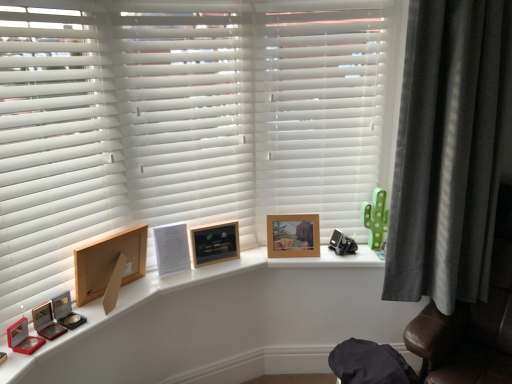
The image size is (512, 384). What are the coordinates of `vacant space to the right of wooden photo frame at center, which appears as the second picture frame when viewed from the front` in the screenshot? It's located at (247, 256).